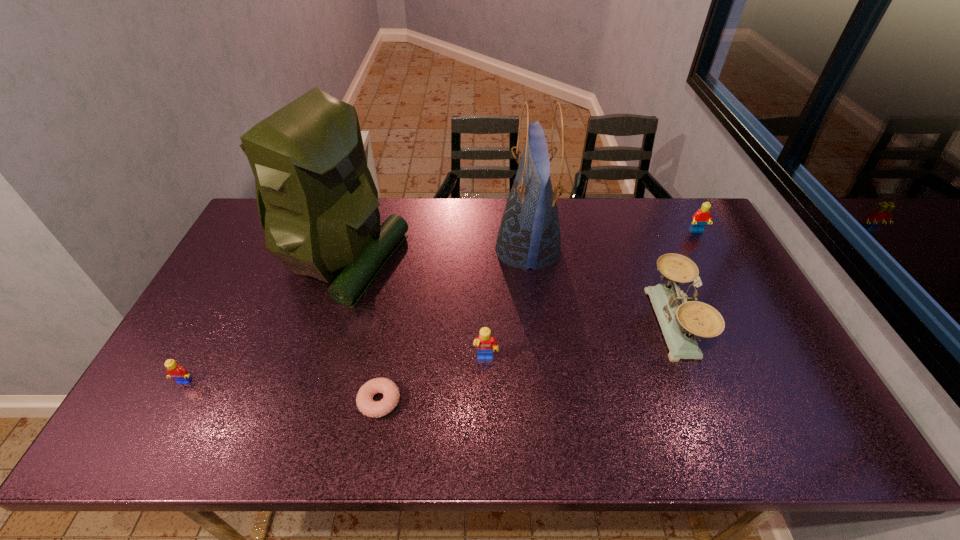
You are a GUI agent. You are given a task and a screenshot of the screen. Output one action in this format:
    pyautogui.click(x=<x>, y=<y>)
    Task: Click on the doughnut
    The height and width of the screenshot is (540, 960).
    Given the screenshot: What is the action you would take?
    pyautogui.click(x=364, y=399)

Locate an element on the screen. This screenshot has height=540, width=960. free space located 0.350m on the front of the backpack with visible pockets is located at coordinates (515, 260).

I want to click on free space located on the left of the third object from right to left, so click(x=480, y=249).

The image size is (960, 540). Find the location of `vacant space situated 0.090m on the front-facing side of the scale`. vacant space situated 0.090m on the front-facing side of the scale is located at coordinates (621, 323).

Where is `blank space located 0.380m on the front-facing side of the scale`? blank space located 0.380m on the front-facing side of the scale is located at coordinates (516, 323).

Find the location of a particular element. This screenshot has width=960, height=540. vacant space located on the front-facing side of the scale is located at coordinates (516, 323).

This screenshot has width=960, height=540. What are the coordinates of `free space located on the face of the rightmost object` in the screenshot? It's located at (737, 305).

You are a GUI agent. You are given a task and a screenshot of the screen. Output one action in this format:
    pyautogui.click(x=<x>, y=<y>)
    Task: Click on the free spot located on the face of the second Lego from right to left
    The width and height of the screenshot is (960, 540).
    Given the screenshot: What is the action you would take?
    pyautogui.click(x=487, y=436)

Find the location of a particular element. This screenshot has width=960, height=540. free region located on the front-facing side of the leftmost Lego is located at coordinates (160, 427).

Identify the location of free space located on the left of the shortest object. This screenshot has width=960, height=540. (217, 401).